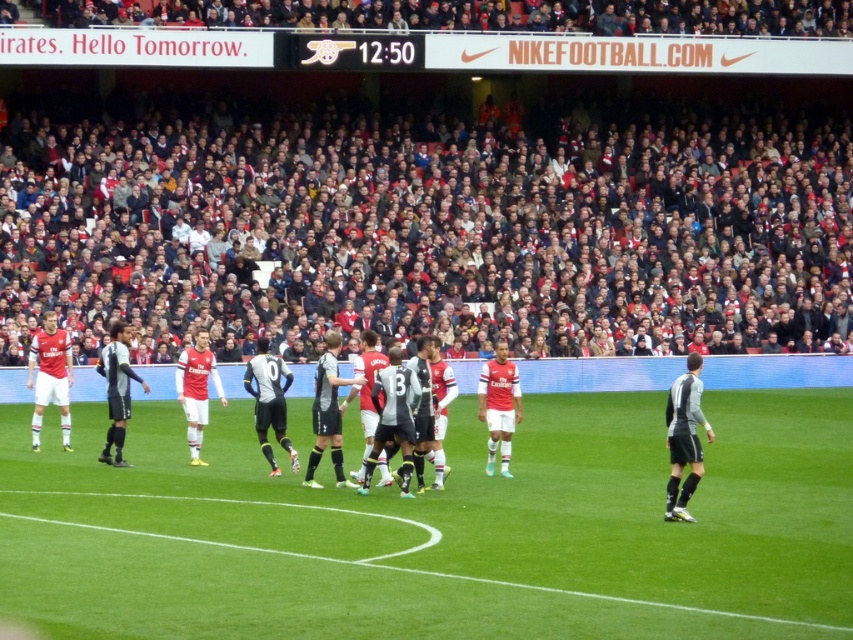
Is white jersey players at center above black jersey at right?

Actually, white jersey players at center is below black jersey at right.

Which is above, white jersey players at center or black jersey at right?

black jersey at right

Measure the distance between point (468, 362) and camera.

The distance of point (468, 362) from camera is 35.24 meters.

At what (x,y) coordinates should I click in order to perform the action: click on white jersey players at center. Please return your answer as a coordinate pair (x, y). This screenshot has height=640, width=853. Looking at the image, I should click on (564, 376).

How distant is dark gray fabric crowd at upper center from black jersey at right?

24.86 meters

Does dark gray fabric crowd at upper center appear on the left side of black jersey at right?

Yes, dark gray fabric crowd at upper center is to the left of black jersey at right.

Is point (120, 131) behind point (668, 410)?

Yes, it is behind point (668, 410).

Locate an element on the screen. Image resolution: width=853 pixels, height=640 pixels. dark gray fabric crowd at upper center is located at coordinates (422, 230).

Does dark gray fabric crowd at upper center appear on the right side of green grass football field at center?

Correct, you'll find dark gray fabric crowd at upper center to the right of green grass football field at center.

Who is more distant from viewer, (746,324) or (56,557)?

The point (746,324) is more distant.

You are a GUI agent. You are given a task and a screenshot of the screen. Output one action in this format:
    pyautogui.click(x=<x>, y=<y>)
    Task: Click on the dark gray fabric crowd at upper center
    
    Given the screenshot: What is the action you would take?
    pyautogui.click(x=422, y=230)